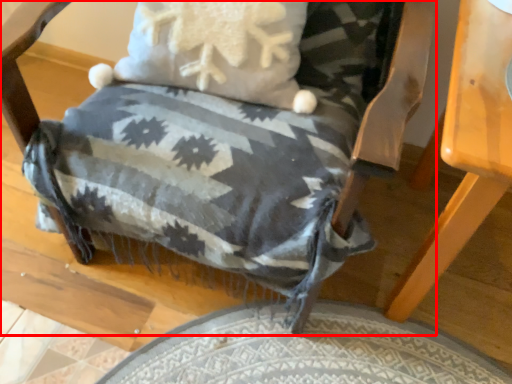
Question: From the image, what is the correct spatial relationship of chair (annotated by the red box) in relation to table?

Choices:
 (A) left
 (B) right

Answer: (A)